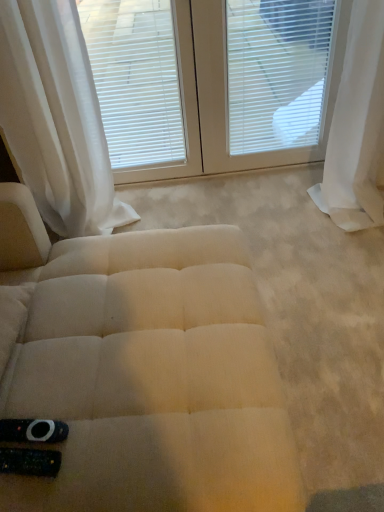
This screenshot has width=384, height=512. In order to click on free point below white matte window blind at upper center (from a real-world perspective) in this screenshot , I will do click(158, 186).